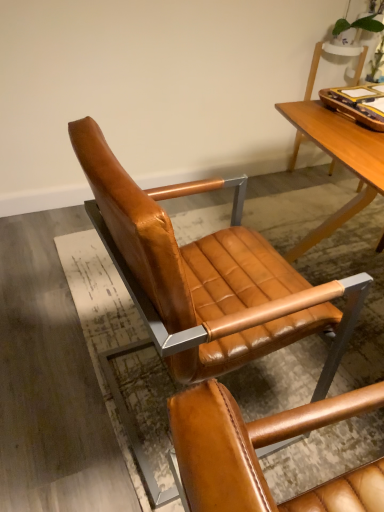
Question: From their relative heights in the image, would you say cognac leather chair at center is taller or shorter than brown leather tray at upper right?

Choices:
 (A) short
 (B) tall

Answer: (B)

Question: Considering the positions of cognac leather chair at center and brown leather tray at upper right in the image, is cognac leather chair at center bigger or smaller than brown leather tray at upper right?

Choices:
 (A) big
 (B) small

Answer: (A)

Question: Is cognac leather chair at center in front of or behind brown leather tray at upper right in the image?

Choices:
 (A) behind
 (B) front

Answer: (B)

Question: Is brown leather tray at upper right wider or thinner than cognac leather chair at center?

Choices:
 (A) thin
 (B) wide

Answer: (A)

Question: Is brown leather tray at upper right inside the boundaries of cognac leather chair at center, or outside?

Choices:
 (A) inside
 (B) outside

Answer: (B)

Question: Visually, is brown leather tray at upper right positioned to the left or to the right of cognac leather chair at center?

Choices:
 (A) right
 (B) left

Answer: (A)

Question: From a real-world perspective, is brown leather tray at upper right above or below cognac leather chair at center?

Choices:
 (A) below
 (B) above

Answer: (B)